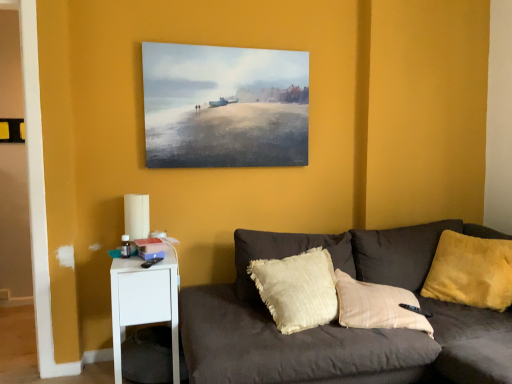
Where is `empty space that is ontop of watercolor painting at upper center (from a real-world perspective)`? The height and width of the screenshot is (384, 512). empty space that is ontop of watercolor painting at upper center (from a real-world perspective) is located at coordinates (224, 43).